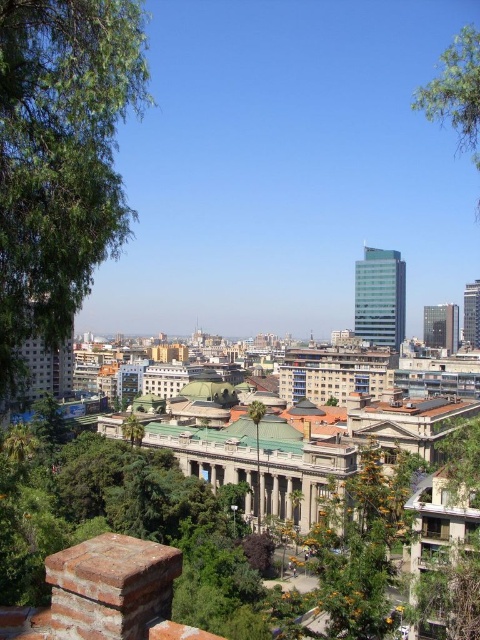
You are standing at the camera position and want to take a photo of the green leafy tree at upper right. If your camera has a maximum zoom range of 200 feet, will you be able to capture the tree clearly without moving closer?

The green leafy tree at upper right and camera are 213.63 feet apart, which exceeds the camera maximum zoom range of 200 feet. Therefore, you will not be able to capture the tree clearly without moving closer.

You are standing in the cityscape scene and want to take a photo of both the green leafy tree at left and the green leafy tree at center. Which tree appears higher in the photo?

The green leafy tree at left appears higher in the photo because it is positioned above the green leafy tree at center.

You are standing in the city park and see the green leafy tree at upper right and the green leafy tree at center. Which tree is located to the right of the other?

The green leafy tree at upper right is positioned on the right side of green leafy tree at center.